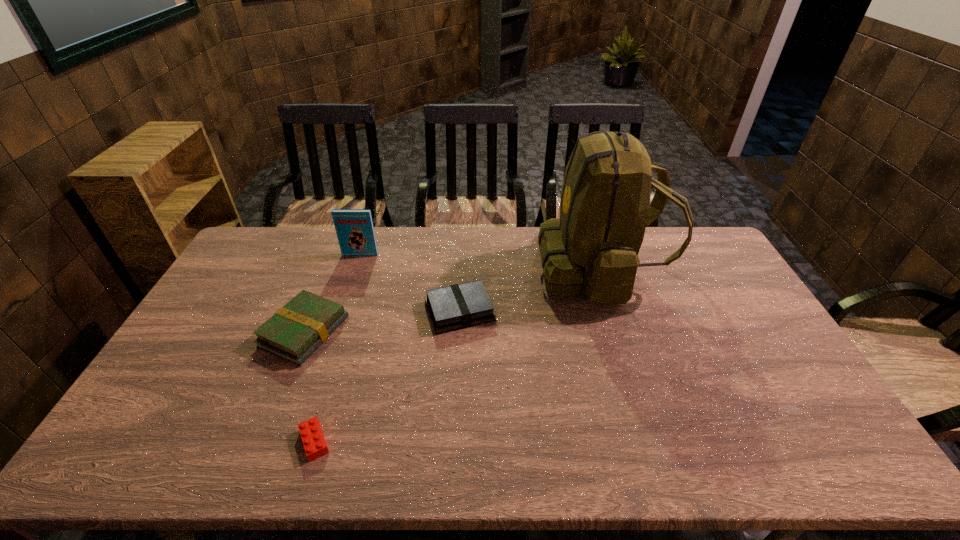
Locate an element on the screen. This screenshot has height=540, width=960. object that ranks as the fourth closest to the nearest object is located at coordinates 593,247.

Identify which object is located as the third nearest to the fourth shortest object. Please provide its 2D coordinates. Your answer should be formatted as a tuple, i.e. [(x, y)], where the tuple contains the x and y coordinates of a point satisfying the conditions above.

[(593, 247)]

Locate which book is the closest to the rightmost book. Please provide its 2D coordinates. Your answer should be formatted as a tuple, i.e. [(x, y)], where the tuple contains the x and y coordinates of a point satisfying the conditions above.

[(295, 331)]

Identify which book is located as the second nearest to the tallest book. Please provide its 2D coordinates. Your answer should be formatted as a tuple, i.e. [(x, y)], where the tuple contains the x and y coordinates of a point satisfying the conditions above.

[(458, 306)]

The width and height of the screenshot is (960, 540). Identify the location of free point that satisfies the following two spatial constraints: 1. on the front-facing side of the backpack; 2. on the front side of the second object from right to left. (612, 310).

Locate an element on the screen. This screenshot has height=540, width=960. free space that satisfies the following two spatial constraints: 1. on the front cover of the fourth object from left to right; 2. on the left side of the tallest book is located at coordinates (342, 310).

What are the coordinates of `free location that satisfies the following two spatial constraints: 1. on the front cover of the farthest book; 2. on the left side of the Lego` in the screenshot? It's located at 299,442.

Locate an element on the screen. free space that satisfies the following two spatial constraints: 1. on the front cover of the nearest object; 2. on the right side of the farthest book is located at coordinates (299, 442).

Locate an element on the screen. Image resolution: width=960 pixels, height=540 pixels. blank space that satisfies the following two spatial constraints: 1. on the front cover of the fourth object from left to right; 2. on the left side of the farthest book is located at coordinates (342, 310).

This screenshot has width=960, height=540. I want to click on free location that satisfies the following two spatial constraints: 1. on the front cover of the shortest object; 2. on the right side of the second tallest object, so pyautogui.click(x=299, y=442).